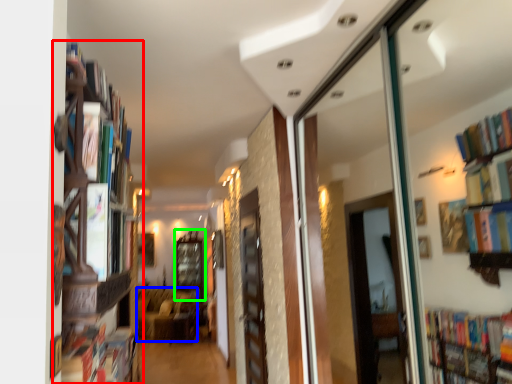
Question: Which is nearer to the bookcase (highlighted by a red box)? furniture (highlighted by a blue box) or window (highlighted by a green box).

Choices:
 (A) furniture
 (B) window

Answer: (A)